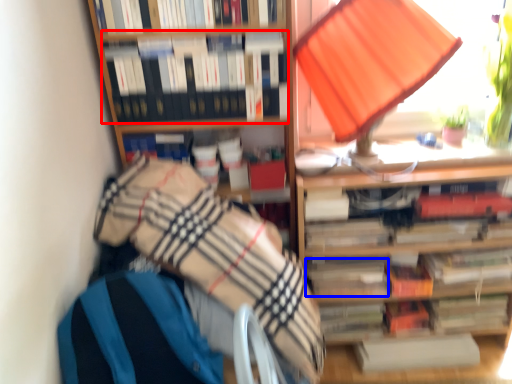
Question: Which object appears farthest to the camera in this image, book (highlighted by a red box) or paperback book (highlighted by a blue box)?

Choices:
 (A) book
 (B) paperback book

Answer: (B)